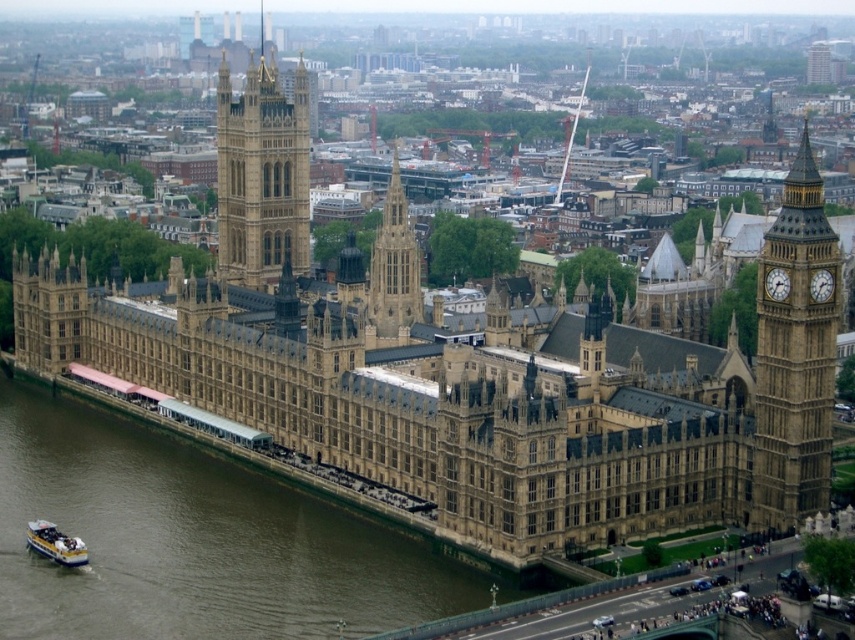
You are a tourist standing in front of the Palace of Westminster. You see the brown water at lower left. Where is the brown water located in relation to the Palace of Westminster?

The brown water at lower left is located at the lower left side of the Palace of Westminster.

You are standing at the point marked as point [193,541] in the image of the Palace of Westminster. Which part of the scene are you currently located in?

The point [193,541] is on brown water at lower left, so you are currently located on the brown water at lower left.

You are a tourist visiting London and want to take a photo of the stone clock tower at right and the blue plastic boat at lower left in the same frame. Based on their sizes, which object will appear bigger in your photo?

The stone clock tower at right will appear bigger in the photo because it has a larger size compared to the blue plastic boat at lower left.